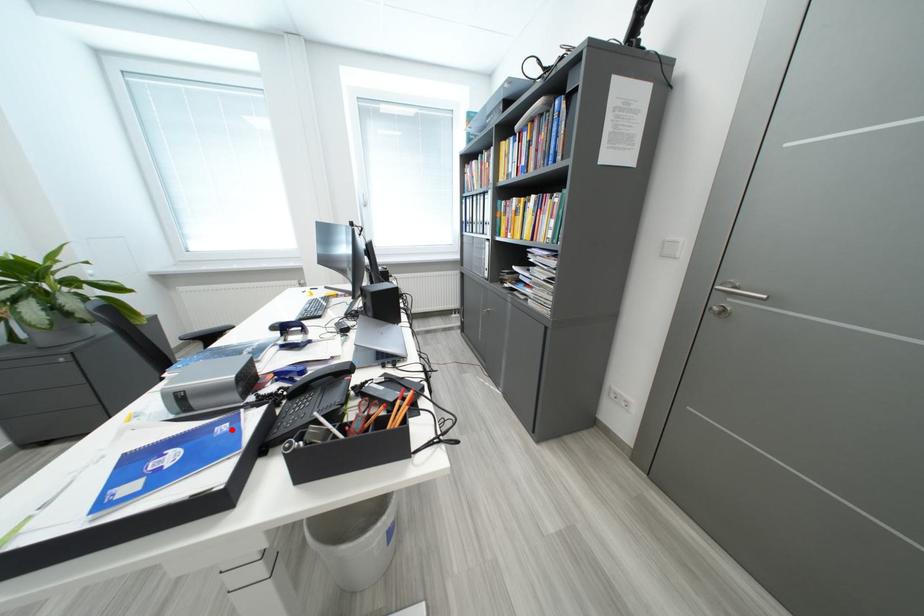
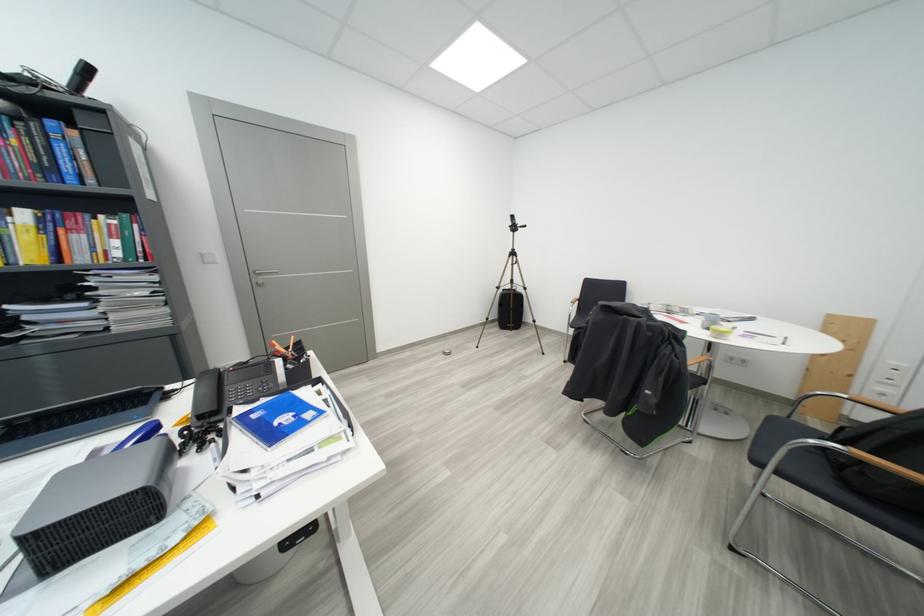
Find the pixel in the second image that matches the highlighted location in the first image.

(263, 419)